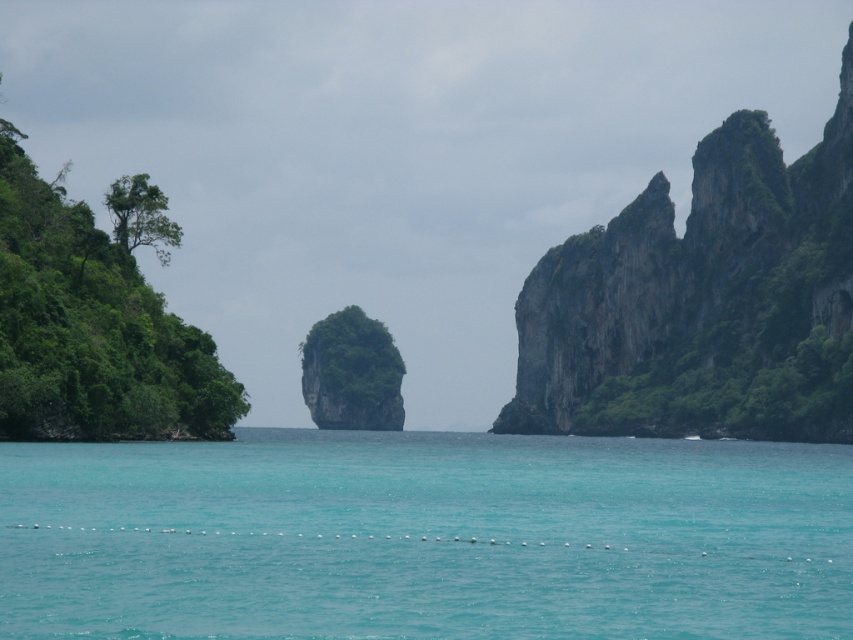
Can you confirm if turquoise water at center is positioned below green mossy rock at right?

Indeed, turquoise water at center is positioned under green mossy rock at right.

This screenshot has height=640, width=853. What are the coordinates of `turquoise water at center` in the screenshot? It's located at (425, 538).

At what (x,y) coordinates should I click in order to perform the action: click on turquoise water at center. Please return your answer as a coordinate pair (x, y). Looking at the image, I should click on (425, 538).